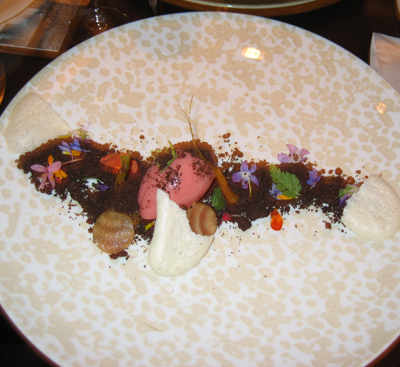
Locate an element on the screen. plate is located at coordinates (285, 60).